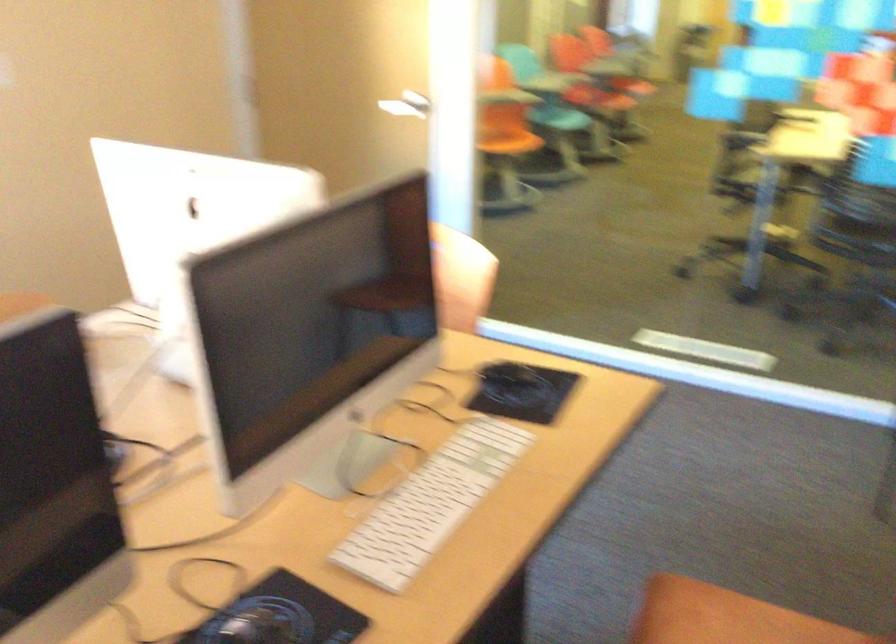
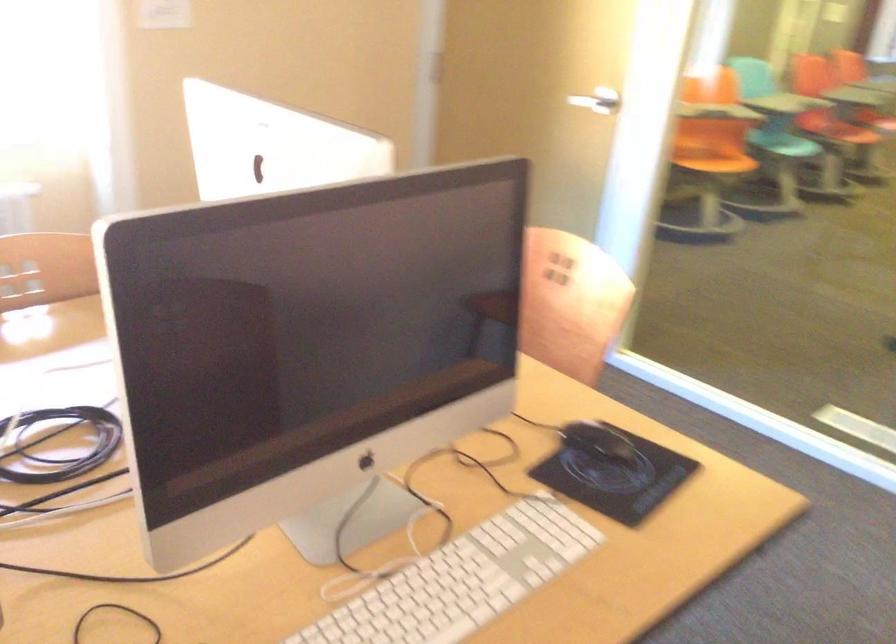
Question: The camera is either moving clockwise (left) or counter-clockwise (right) around the object. The first image is from the beginning of the video and the second image is from the end. Is the camera moving left or right when shooting the video?

Choices:
 (A) Left
 (B) Right

Answer: (B)